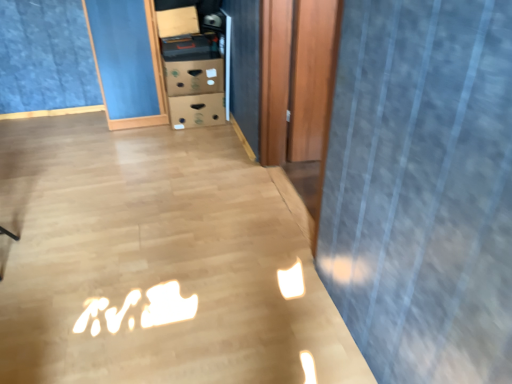
The height and width of the screenshot is (384, 512). What do you see at coordinates (298, 84) in the screenshot?
I see `wooden door at center` at bounding box center [298, 84].

Identify the location of wooden door at center. [x=298, y=84].

You are a GUI agent. You are given a task and a screenshot of the screen. Output one action in this format:
    pyautogui.click(x=<x>, y=<y>)
    Task: Click on the wooden door at center
    Image resolution: width=512 pixels, height=384 pixels.
    Given the screenshot: What is the action you would take?
    pyautogui.click(x=298, y=84)